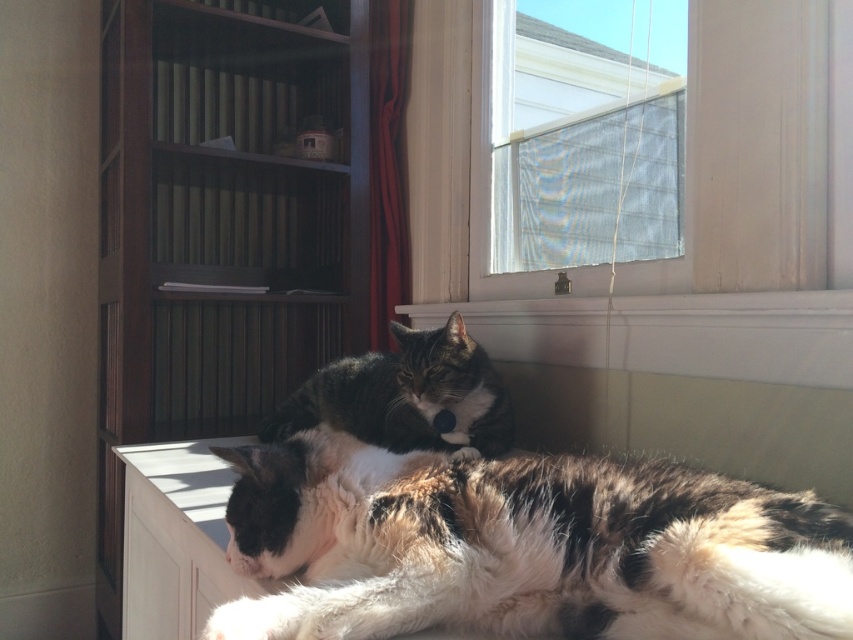
Consider the image. You are standing in the room and want to know where the white textured curtain at upper right is located. Can you describe its position relative to the cats?

The white textured curtain at upper right is located at the upper right corner of the window, positioned above and to the right of both cats.